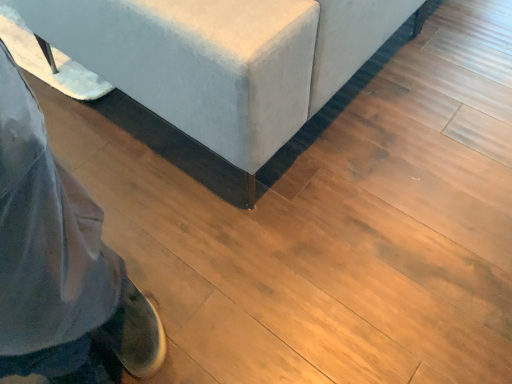
I want to click on velvet fabric ottoman at center, so click(224, 59).

Describe the element at coordinates (224, 59) in the screenshot. I see `velvet fabric ottoman at center` at that location.

You are a GUI agent. You are given a task and a screenshot of the screen. Output one action in this format:
    pyautogui.click(x=<x>, y=<y>)
    Task: Click on the velvet fabric ottoman at center
    
    Given the screenshot: What is the action you would take?
    pyautogui.click(x=224, y=59)